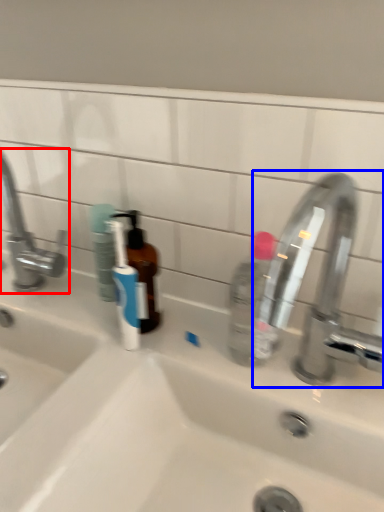
Question: Which of the following is the farthest to the observer, tap (highlighted by a red box) or tap (highlighted by a blue box)?

Choices:
 (A) tap
 (B) tap

Answer: (A)